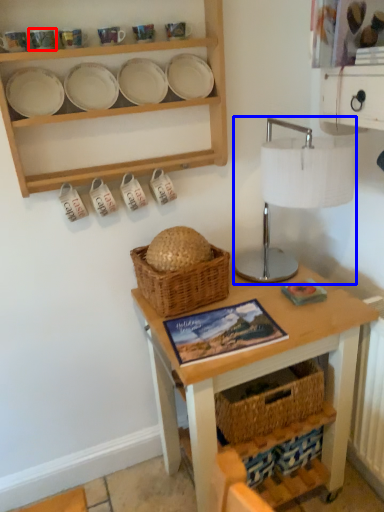
Question: Among these objects, which one is farthest to the camera, tableware (highlighted by a red box) or table lamp (highlighted by a blue box)?

Choices:
 (A) tableware
 (B) table lamp

Answer: (A)